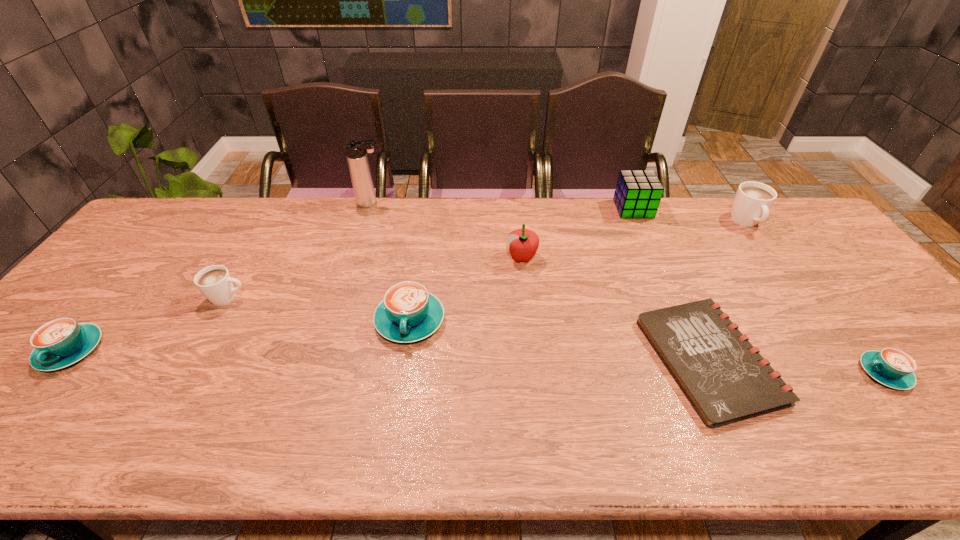
The width and height of the screenshot is (960, 540). What are the coordinates of `vacant space located 0.130m with the handle on the right side of the second turquoise cappuccino from right to left` in the screenshot? It's located at (398, 396).

Where is `vacant space located with the handle on the side of the eighth object from right to left`? The width and height of the screenshot is (960, 540). vacant space located with the handle on the side of the eighth object from right to left is located at coordinates (318, 298).

This screenshot has width=960, height=540. I want to click on vacant space located with the handle on the right side of the second biggest turquoise cappuccino, so click(35, 395).

The image size is (960, 540). In order to click on vacant space located 0.280m with the handle on the right side of the smallest turquoise cappuccino in this screenshot , I will do `click(741, 373)`.

In order to click on blank area located 0.150m with the handle on the right side of the smallest turquoise cappuccino in this screenshot , I will do `click(797, 373)`.

Image resolution: width=960 pixels, height=540 pixels. Identify the location of blank space located 0.200m with the handle on the right side of the smallest turquoise cappuccino. (776, 373).

Find the location of a particular element. This screenshot has width=960, height=540. blank area located 0.340m on the back of the notebook is located at coordinates (649, 227).

Locate an element on the screen. The height and width of the screenshot is (540, 960). thermos bottle at the far edge is located at coordinates (356, 151).

Image resolution: width=960 pixels, height=540 pixels. In order to click on cube present at the far edge in this screenshot , I will do `click(638, 193)`.

Find the location of a particular element. cappuccino at the far edge is located at coordinates (751, 205).